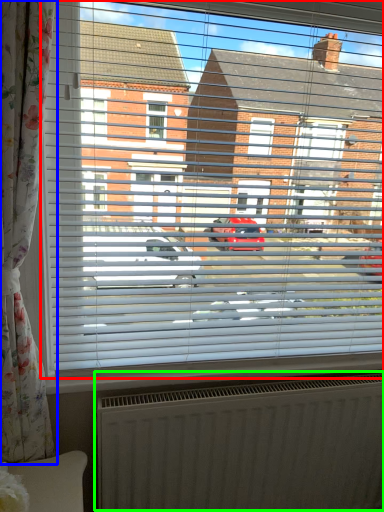
Question: Which is nearer to the window (highlighted by a red box)? curtain (highlighted by a blue box) or radiator (highlighted by a green box).

Choices:
 (A) curtain
 (B) radiator

Answer: (A)